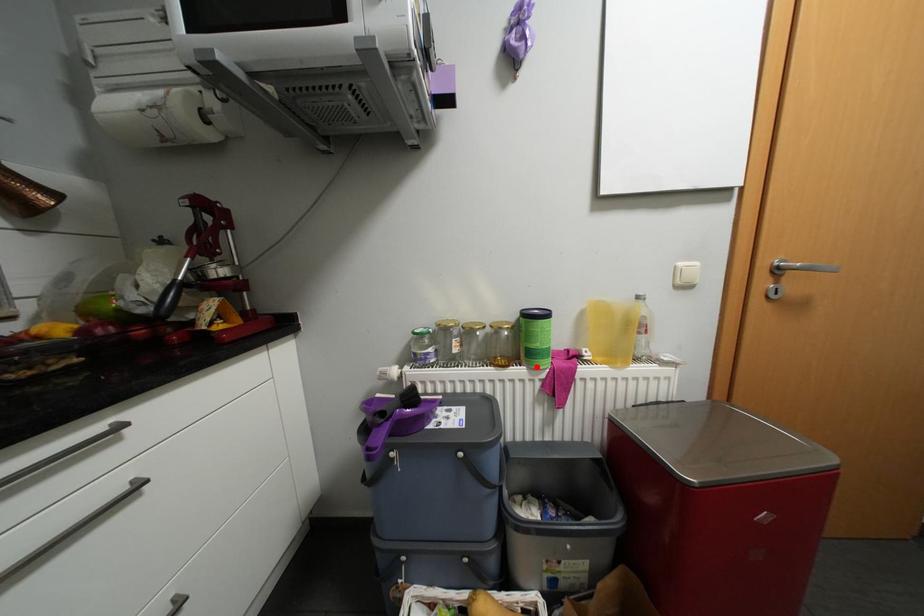
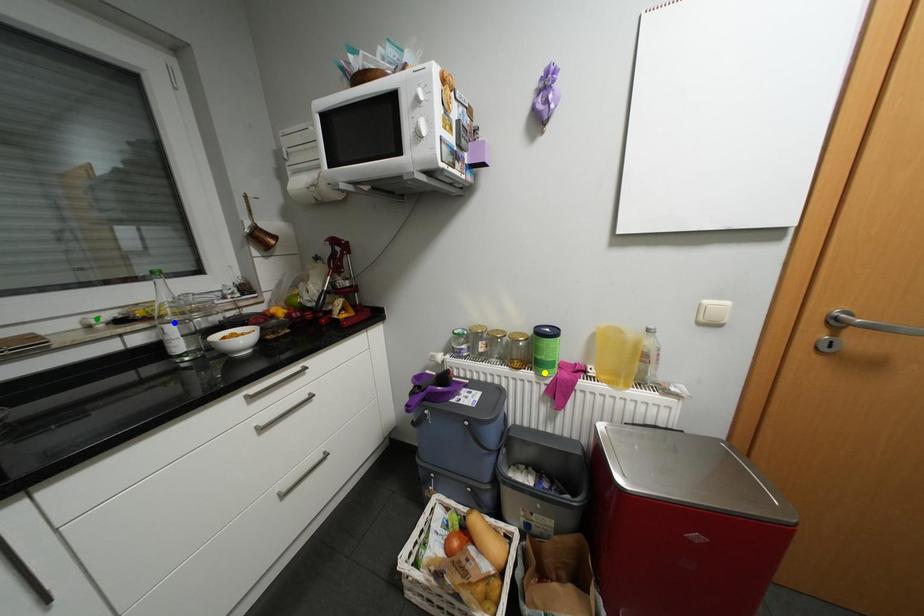
Question: I am providing you with two images of the same scene from different viewpoints. A red point is marked on the first image. You are given multiple points on the second image. Which mark in image 2 goes with the point in image 1?

Choices:
 (A) green point
 (B) blue point
 (C) yellow point

Answer: (C)